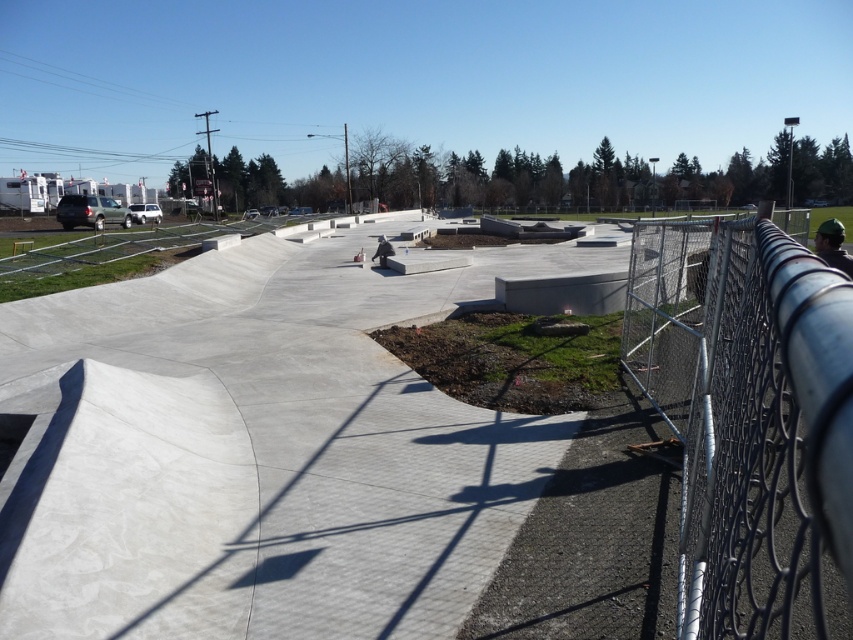
Can you confirm if concrete skate park at center is bigger than silver chain-link fence at right?

Correct, concrete skate park at center is larger in size than silver chain-link fence at right.

Locate an element on the screen. Image resolution: width=853 pixels, height=640 pixels. concrete skate park at center is located at coordinates (253, 452).

This screenshot has width=853, height=640. I want to click on concrete skate park at center, so click(x=253, y=452).